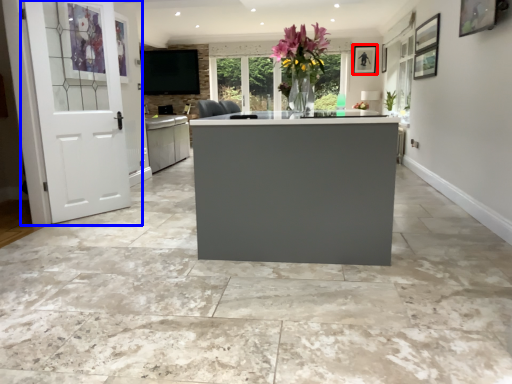
Question: Which point is further to the camera, picture frame (highlighted by a red box) or door (highlighted by a blue box)?

Choices:
 (A) picture frame
 (B) door

Answer: (A)